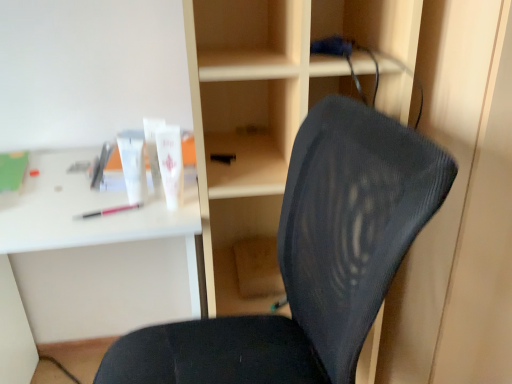
The image size is (512, 384). Identify the location of free space that is to the left of white matte tube at upper center, the 3th toiletry in the left-to-right sequence. (100, 207).